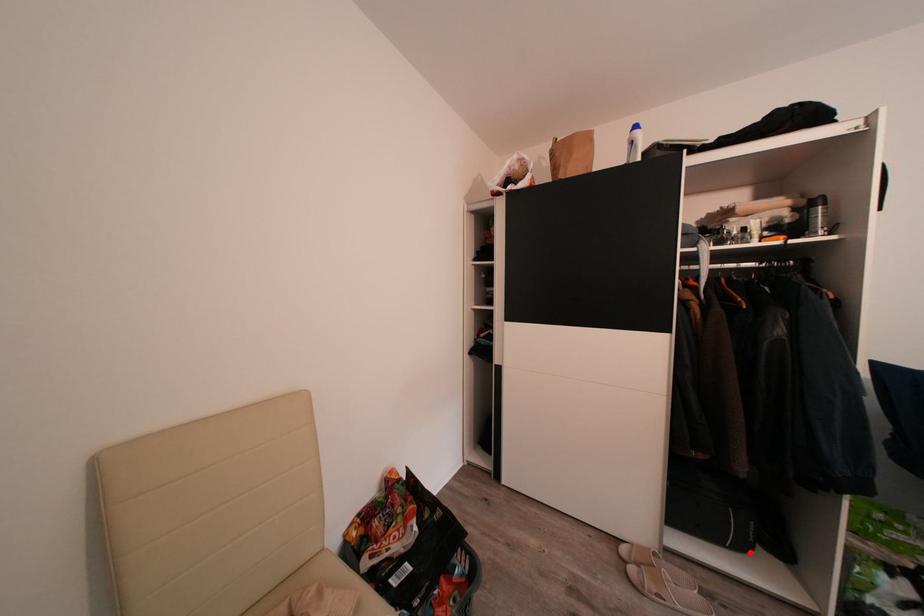
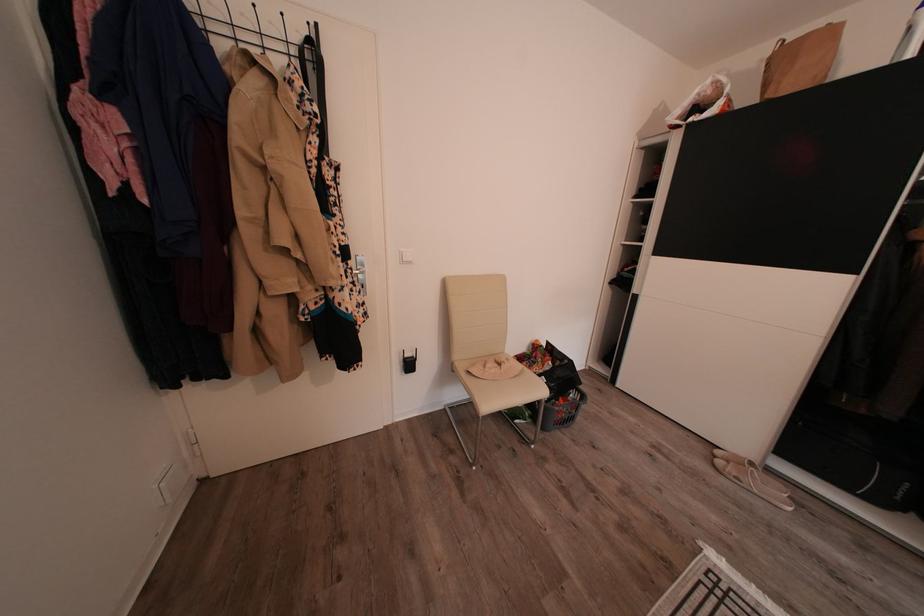
In the second image, find the point that corresponds to the highlighted location in the first image.

(888, 507)